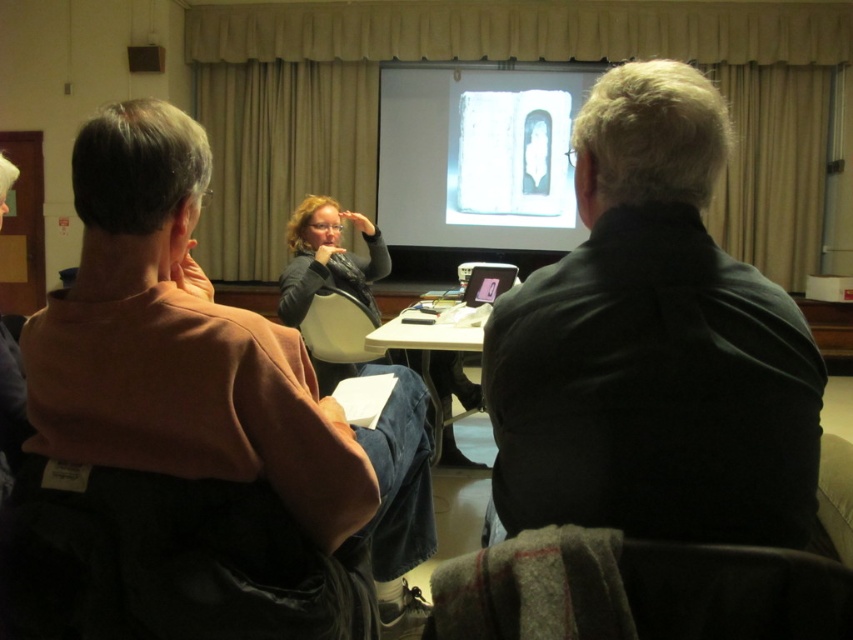
Can you confirm if white matte projection screen at center is taller than white plastic table at center?

Yes.

Which is below, white matte projection screen at center or white plastic table at center?

white plastic table at center is lower down.

Between point (575, 83) and point (370, 348), which one is positioned behind?

The point (575, 83) is more distant.

The height and width of the screenshot is (640, 853). Find the location of `white matte projection screen at center`. white matte projection screen at center is located at coordinates (479, 157).

Which is below, brown cotton shirt at left or white plastic table at center?

brown cotton shirt at left is below.

Which of these two, brown cotton shirt at left or white plastic table at center, stands taller?

Standing taller between the two is brown cotton shirt at left.

Where is `brown cotton shirt at left`? Image resolution: width=853 pixels, height=640 pixels. brown cotton shirt at left is located at coordinates (207, 364).

Is brown cotton shirt at left below white matte projection screen at center?

Yes.

Can you confirm if brown cotton shirt at left is bigger than white matte projection screen at center?

No, brown cotton shirt at left is not bigger than white matte projection screen at center.

Find the location of `brown cotton shirt at left`. brown cotton shirt at left is located at coordinates (207, 364).